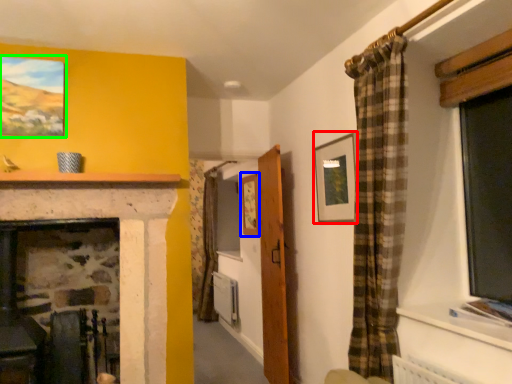
Question: Which object is positioned farthest from picture frame (highlighted by a red box)? Select from picture frame (highlighted by a blue box) and picture frame (highlighted by a green box).

Choices:
 (A) picture frame
 (B) picture frame

Answer: (B)